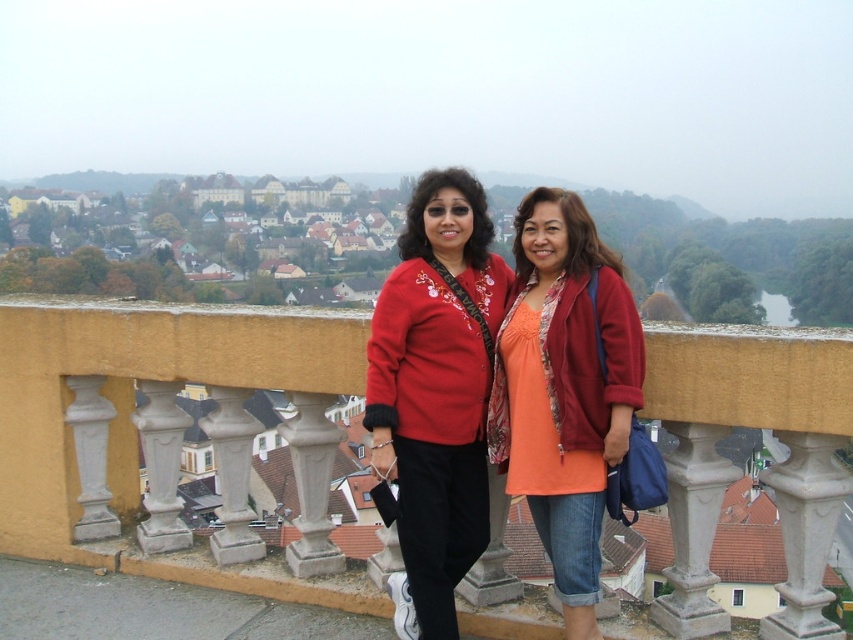
Who is more distant from viewer, (292,442) or (634,408)?

Positioned behind is point (292,442).

Can you confirm if yellow stone bridge at center is taller than matte orange blouse at center?

Correct, yellow stone bridge at center is much taller as matte orange blouse at center.

This screenshot has height=640, width=853. In order to click on yellow stone bridge at center in this screenshot , I will do `click(157, 410)`.

At what (x,y) coordinates should I click in order to perform the action: click on yellow stone bridge at center. Please return your answer as a coordinate pair (x, y). This screenshot has width=853, height=640. Looking at the image, I should click on (157, 410).

Consider the image. Can you confirm if yellow stone bridge at center is taller than matte red sweater at center?

Yes, yellow stone bridge at center is taller than matte red sweater at center.

The height and width of the screenshot is (640, 853). What do you see at coordinates (157, 410) in the screenshot?
I see `yellow stone bridge at center` at bounding box center [157, 410].

Is point (791, 436) less distant than point (486, 400)?

Yes, point (791, 436) is closer to viewer.

Identify the location of yellow stone bridge at center. This screenshot has width=853, height=640. [x=157, y=410].

Is matte red sweater at center positioned before matte orange blouse at center?

No, matte red sweater at center is further to the viewer.

Is matte red sweater at center shorter than matte orange blouse at center?

Yes, matte red sweater at center is shorter than matte orange blouse at center.

Where is `matte red sweater at center`? matte red sweater at center is located at coordinates (436, 387).